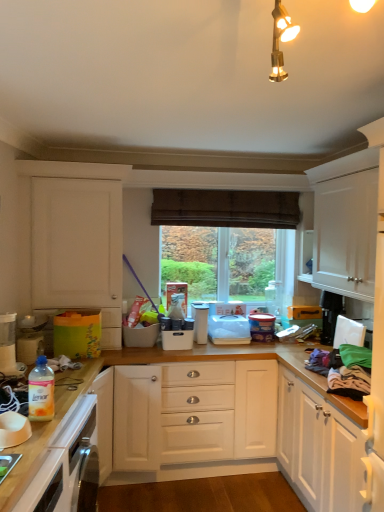
Question: Can you confirm if white plastic container at center, arranged as the third appliance when viewed from the right, is thinner than white plastic container at center, the first appliance positioned from the left?

Choices:
 (A) no
 (B) yes

Answer: (A)

Question: Are white plastic container at center, acting as the 2th appliance starting from the left, and white plastic container at center, placed as the fourth appliance when sorted from right to left, beside each other?

Choices:
 (A) no
 (B) yes

Answer: (A)

Question: Is white plastic container at center, arranged as the third appliance when viewed from the right, shorter than white plastic container at center, placed as the fourth appliance when sorted from right to left?

Choices:
 (A) no
 (B) yes

Answer: (A)

Question: Is white plastic container at center, acting as the 2th appliance starting from the left, wider than white plastic container at center, the first appliance positioned from the left?

Choices:
 (A) no
 (B) yes

Answer: (B)

Question: From the image's perspective, is white plastic container at center, acting as the 2th appliance starting from the left, under white plastic container at center, placed as the fourth appliance when sorted from right to left?

Choices:
 (A) yes
 (B) no

Answer: (B)

Question: Visually, is black plastic toaster at upper right, marked as the fourth appliance in a left-to-right arrangement, positioned to the left or to the right of white plastic container at center, the first appliance positioned from the left?

Choices:
 (A) left
 (B) right

Answer: (B)

Question: Does point (340, 300) appear closer or farther from the camera than point (183, 331)?

Choices:
 (A) farther
 (B) closer

Answer: (B)

Question: From a real-world perspective, is black plastic toaster at upper right, which appears as the first appliance when viewed from the right, above or below white plastic container at center, placed as the fourth appliance when sorted from right to left?

Choices:
 (A) above
 (B) below

Answer: (A)

Question: From the image's perspective, is black plastic toaster at upper right, which appears as the first appliance when viewed from the right, located above or below white plastic container at center, the first appliance positioned from the left?

Choices:
 (A) above
 (B) below

Answer: (A)

Question: Does point (332, 294) appear closer or farther from the camera than point (195, 309)?

Choices:
 (A) farther
 (B) closer

Answer: (B)

Question: Is black plastic toaster at upper right, marked as the fourth appliance in a left-to-right arrangement, bigger or smaller than white plastic container at center, acting as the 2th appliance starting from the left?

Choices:
 (A) big
 (B) small

Answer: (A)

Question: Looking at their shapes, would you say black plastic toaster at upper right, which appears as the first appliance when viewed from the right, is wider or thinner than white plastic container at center, arranged as the third appliance when viewed from the right?

Choices:
 (A) thin
 (B) wide

Answer: (B)

Question: Considering their positions, is black plastic toaster at upper right, marked as the fourth appliance in a left-to-right arrangement, located in front of or behind white plastic container at center, arranged as the third appliance when viewed from the right?

Choices:
 (A) front
 (B) behind

Answer: (B)

Question: From the image's perspective, relative to translucent plastic bottle at lower left, is white plastic container at center, the first appliance positioned from the left, above or below?

Choices:
 (A) below
 (B) above

Answer: (A)

Question: Considering their positions, is white plastic container at center, placed as the fourth appliance when sorted from right to left, located in front of or behind translucent plastic bottle at lower left?

Choices:
 (A) behind
 (B) front

Answer: (A)